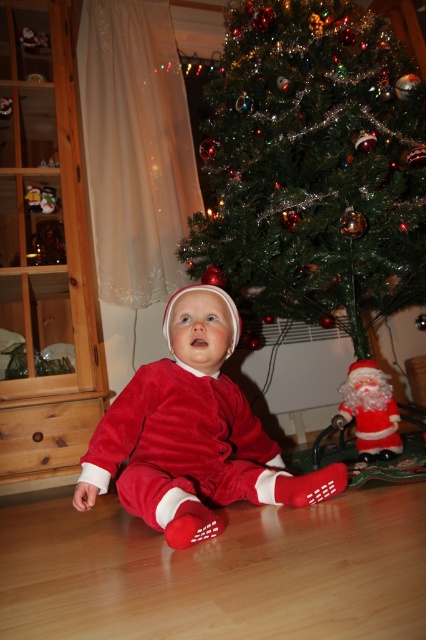
In the scene shown: Is green shiny christmas tree at center shorter than velvet red santa suit at center?

Incorrect, green shiny christmas tree at center's height does not fall short of velvet red santa suit at center's.

Based on the photo, does green shiny christmas tree at center appear over velvet red santa suit at center?

Correct, green shiny christmas tree at center is located above velvet red santa suit at center.

Is point (261, 234) less distant than point (198, 406)?

No, it is not.

This screenshot has width=426, height=640. I want to click on green shiny christmas tree at center, so click(313, 164).